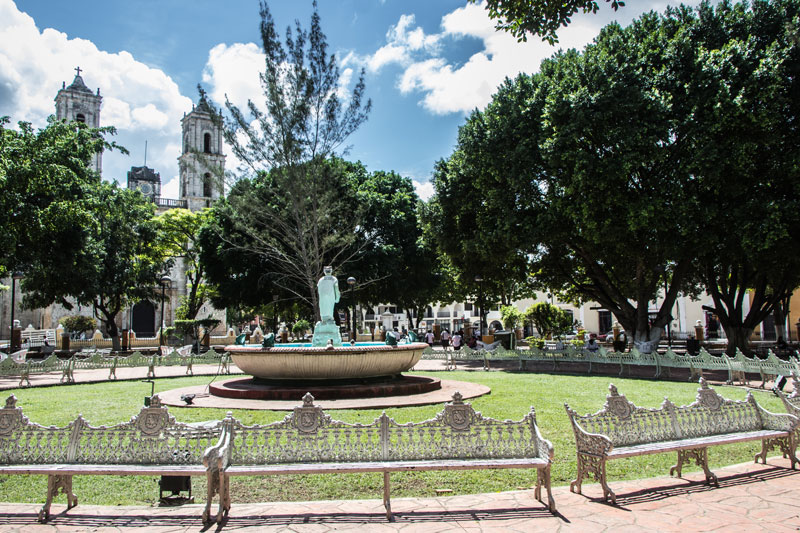
The width and height of the screenshot is (800, 533). In order to click on statue in this screenshot , I will do `click(326, 302)`.